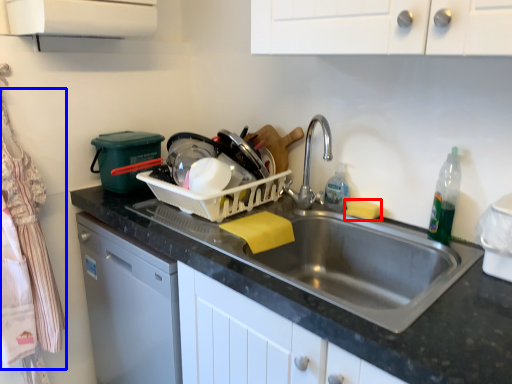
Question: Among these objects, which one is farthest to the camera, food (highlighted by a red box) or laundry (highlighted by a blue box)?

Choices:
 (A) food
 (B) laundry

Answer: (A)